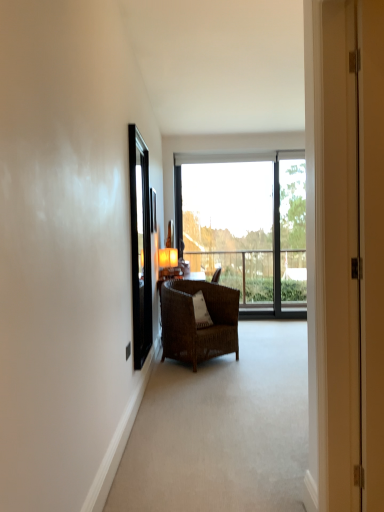
At what (x,y) coordinates should I click in order to perform the action: click on vacant space to the right of brown wicker chair at center. Please return your answer as a coordinate pair (x, y). Looking at the image, I should click on (266, 356).